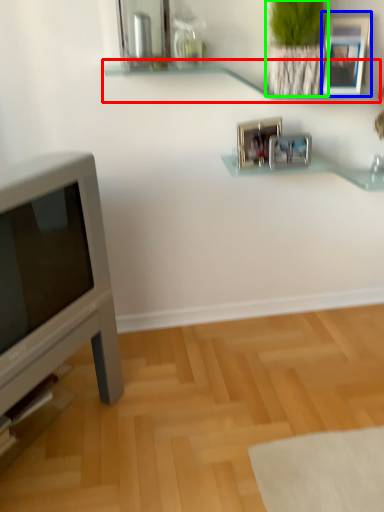
Question: Estimate the real-world distances between objects in this image. Which object is closer to shelf (highlighted by a red box), picture frame (highlighted by a blue box) or plant (highlighted by a green box)?

Choices:
 (A) picture frame
 (B) plant

Answer: (B)